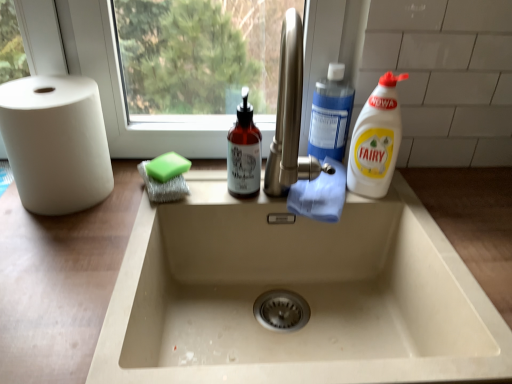
Question: Based on their sizes in the image, would you say blue plastic bottle at upper right, acting as the second cleaning product starting from the right, is bigger or smaller than white plastic bottle at right, marked as the third cleaning product in a left-to-right arrangement?

Choices:
 (A) big
 (B) small

Answer: (B)

Question: From their relative heights in the image, would you say blue plastic bottle at upper right, acting as the second cleaning product starting from the right, is taller or shorter than white plastic bottle at right, positioned as the 1th cleaning product in right-to-left order?

Choices:
 (A) short
 (B) tall

Answer: (A)

Question: Which is nearer to the green sponge at upper left?

Choices:
 (A) white plastic bottle at right, positioned as the 1th cleaning product in right-to-left order
 (B) blue plastic bottle at upper right, which is counted as the second cleaning product, starting from the left
 (C) translucent amber bottle at center, which is the 3th cleaning product in right-to-left order
 (D) white matte paper towel at left

Answer: (C)

Question: Which object is positioned closest to the white plastic bottle at right, marked as the third cleaning product in a left-to-right arrangement?

Choices:
 (A) translucent amber bottle at center, which is the 3th cleaning product in right-to-left order
 (B) green sponge at upper left
 (C) blue plastic bottle at upper right, which is counted as the second cleaning product, starting from the left
 (D) white matte paper towel at left

Answer: (C)